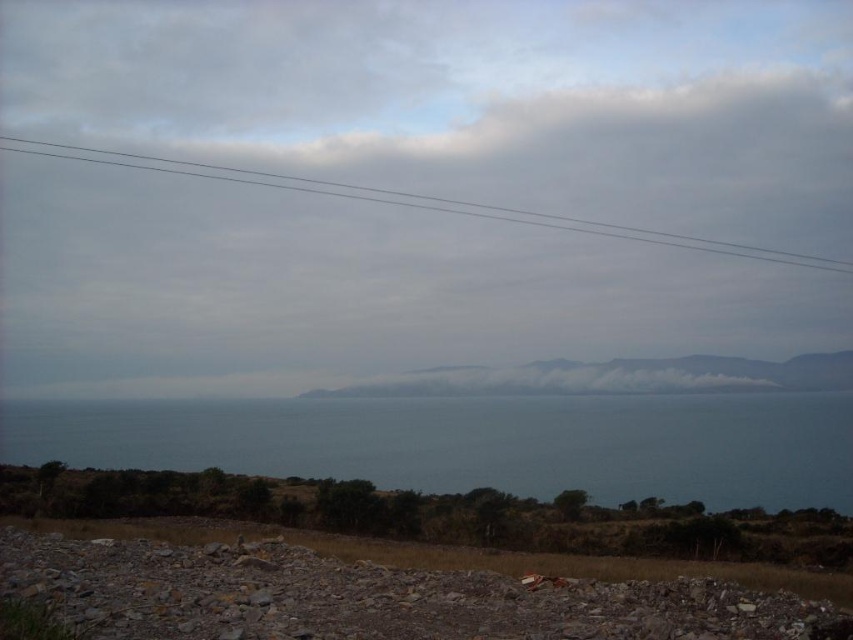
You are a landscape photographer planning to capture the coastal scene. You notice the gray gravel pile at lower center and the gray wire at upper center. Which object takes up more area in the image?

The gray wire at upper center occupies more space than the gray gravel pile at lower center.

You are standing on the rugged terrain in the foreground of the coastal landscape. You see two points marked in the scene. Which point, point (730, 637) or point (589, 220), is closer to your current position?

Point (730, 637) is closer to the viewer than point (589, 220), so the point (730, 637) is closer to your current position.

You are standing at the edge of the rugged terrain in the coastal landscape. You see the blue water at center and the gray gravel pile at lower center. Which object is closer to you? Please explain your reasoning based on their positions.

The gray gravel pile at lower center is closer to you because it is positioned behind the blue water at center, meaning the blue water is between you and the gravel pile.